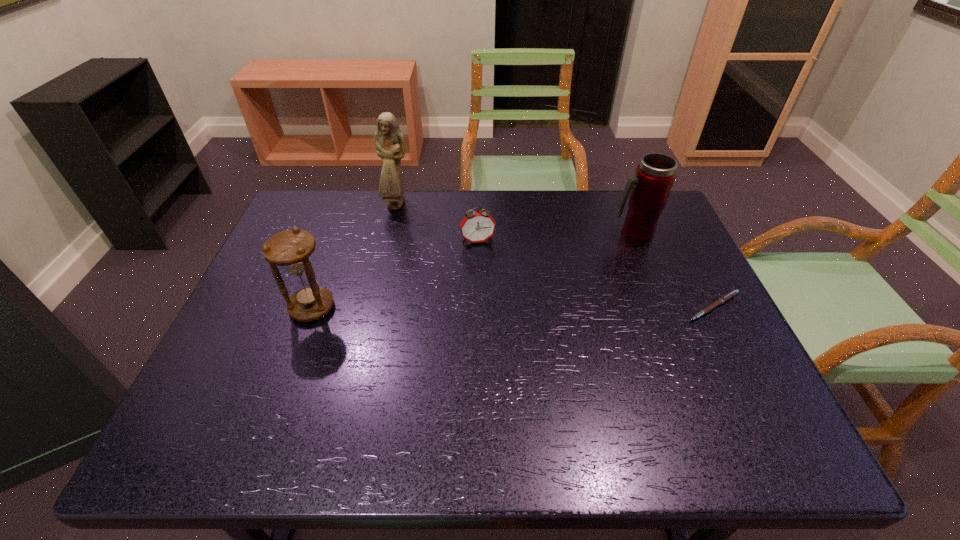
Locate an element on the screen. This screenshot has height=540, width=960. figurine at the far edge is located at coordinates (389, 142).

This screenshot has width=960, height=540. Find the location of `object positioned at the left edge`. object positioned at the left edge is located at coordinates (290, 249).

Identify the location of pen present at the right edge. click(726, 297).

This screenshot has height=540, width=960. Identify the location of thermos bottle positioned at the right edge. (649, 189).

The height and width of the screenshot is (540, 960). What are the coordinates of `object at the far right corner` in the screenshot? It's located at (649, 189).

At what (x,y) coordinates should I click in order to perform the action: click on blank space at the far edge of the desktop. Please return your answer as a coordinate pair (x, y). The image size is (960, 540). Looking at the image, I should click on (568, 218).

Image resolution: width=960 pixels, height=540 pixels. What are the coordinates of `vacant space at the near edge of the desktop` in the screenshot? It's located at (449, 377).

The image size is (960, 540). In the image, there is a desktop. Identify the location of free space at the left edge. (276, 306).

This screenshot has height=540, width=960. In order to click on vacant space at the right edge of the desktop in this screenshot , I will do `click(652, 264)`.

Find the location of a particular element. free space at the far left corner of the desktop is located at coordinates (332, 207).